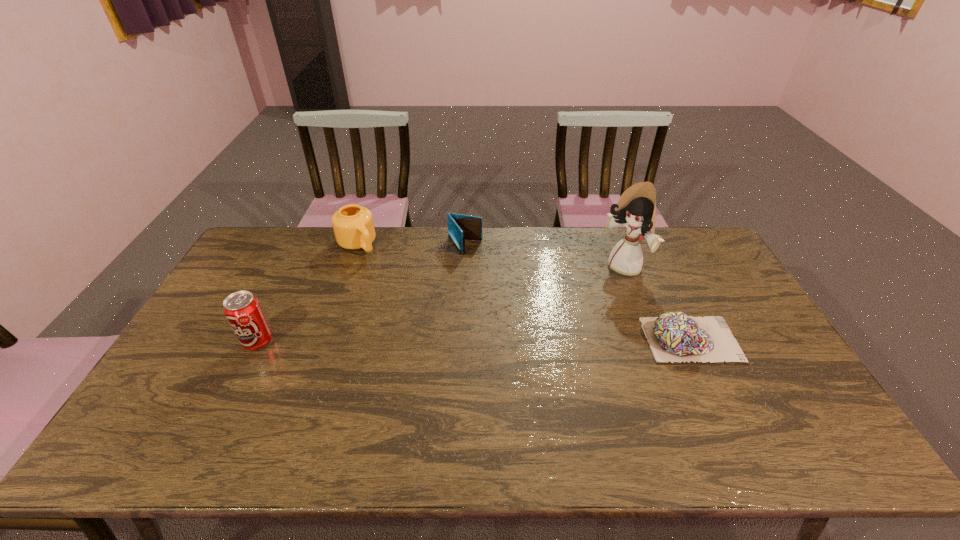
Find the location of `doll located in the far edge section of the desktop`. doll located in the far edge section of the desktop is located at coordinates (636, 209).

This screenshot has height=540, width=960. In order to click on mug located at the far edge in this screenshot , I will do `click(353, 225)`.

What are the coordinates of `object located in the left edge section of the desktop` in the screenshot? It's located at (243, 311).

Where is `object that is at the right edge`? The height and width of the screenshot is (540, 960). object that is at the right edge is located at coordinates (673, 336).

The width and height of the screenshot is (960, 540). In order to click on free location at the far edge in this screenshot , I will do `click(479, 253)`.

This screenshot has width=960, height=540. In order to click on blank space at the near edge of the desktop in this screenshot , I will do `click(240, 407)`.

At what (x,y) coordinates should I click in order to perform the action: click on vacant area at the left edge. Please return your answer as a coordinate pair (x, y). This screenshot has height=540, width=960. Looking at the image, I should click on (216, 360).

The width and height of the screenshot is (960, 540). In the image, there is a desktop. What are the coordinates of `vacant region at the right edge` in the screenshot? It's located at (736, 303).

Locate an element on the screen. This screenshot has width=960, height=540. free space at the far left corner of the desktop is located at coordinates (278, 249).

Identify the location of free space between the soda and the doll. (441, 305).